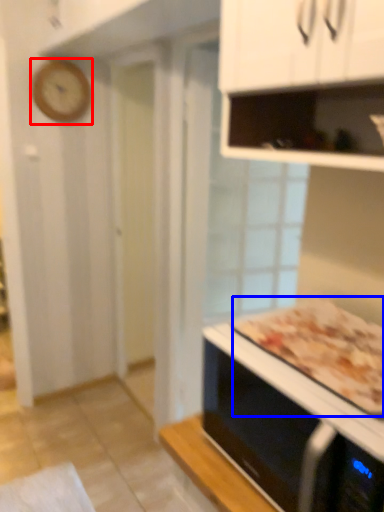
Question: Which of the following is the closest to the observer, clock (highlighted by a red box) or pizza (highlighted by a blue box)?

Choices:
 (A) clock
 (B) pizza

Answer: (B)